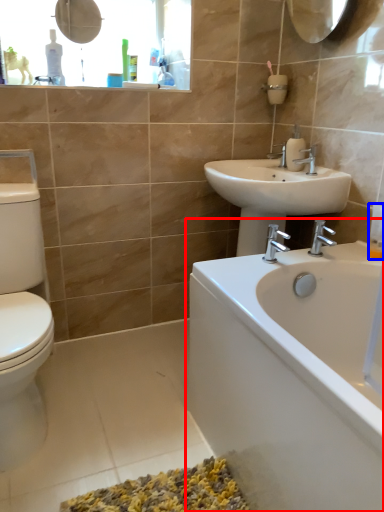
Question: Which of the following is the farthest to the observer, bathtub (highlighted by a red box) or toiletry (highlighted by a blue box)?

Choices:
 (A) bathtub
 (B) toiletry

Answer: (B)